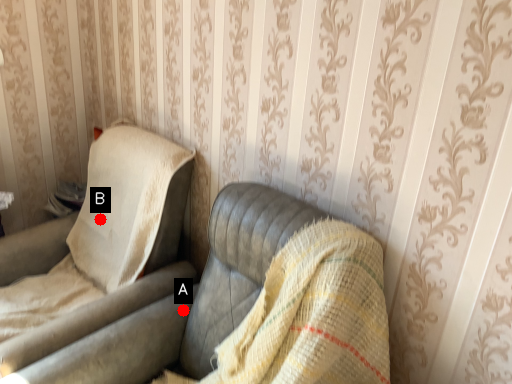
Question: Two points are circled on the image, labeled by A and B beside each circle. Which point is closer to the camera?

Choices:
 (A) A is closer
 (B) B is closer

Answer: (A)